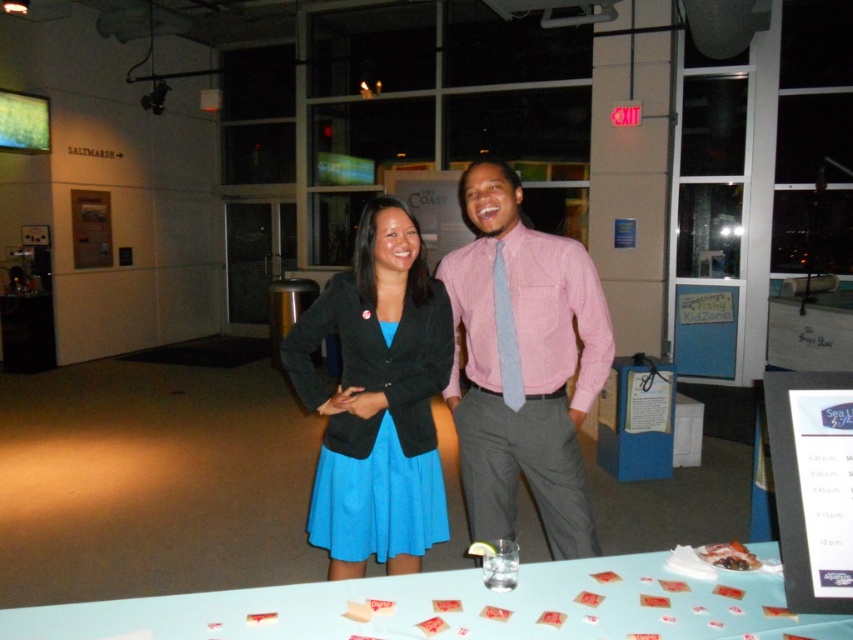
Question: Which object is closer to the camera taking this photo?

Choices:
 (A) light blue textured tie at center
 (B) light blue plastic table at center

Answer: (B)

Question: Based on their relative distances, which object is farther from the light blue plastic table at center?

Choices:
 (A) light blue textured tie at center
 (B) pink checkered shirt at center
 (C) blue fabric dress at center

Answer: (B)

Question: Considering the real-world distances, which object is farthest from the light blue textured tie at center?

Choices:
 (A) pink checkered shirt at center
 (B) blue fabric dress at center
 (C) light blue plastic table at center

Answer: (C)

Question: Can you confirm if light blue plastic table at center is positioned to the left of blue fabric dress at center?

Choices:
 (A) yes
 (B) no

Answer: (B)

Question: Does light blue plastic table at center have a smaller size compared to light blue textured tie at center?

Choices:
 (A) no
 (B) yes

Answer: (A)

Question: Is pink checkered shirt at center in front of light blue textured tie at center?

Choices:
 (A) no
 (B) yes

Answer: (B)